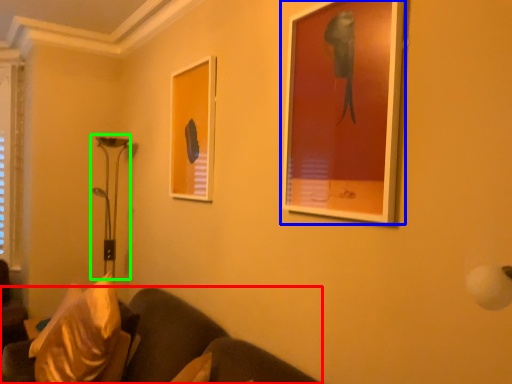
Question: Which object is positioned farthest from studio couch (highlighted by a red box)? Select from picture frame (highlighted by a blue box) and table lamp (highlighted by a green box).

Choices:
 (A) picture frame
 (B) table lamp

Answer: (B)